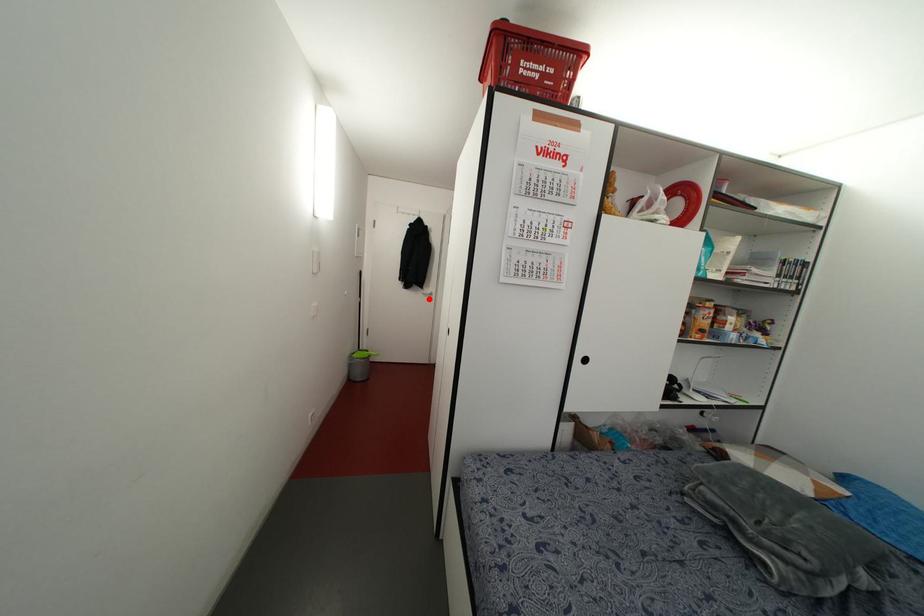
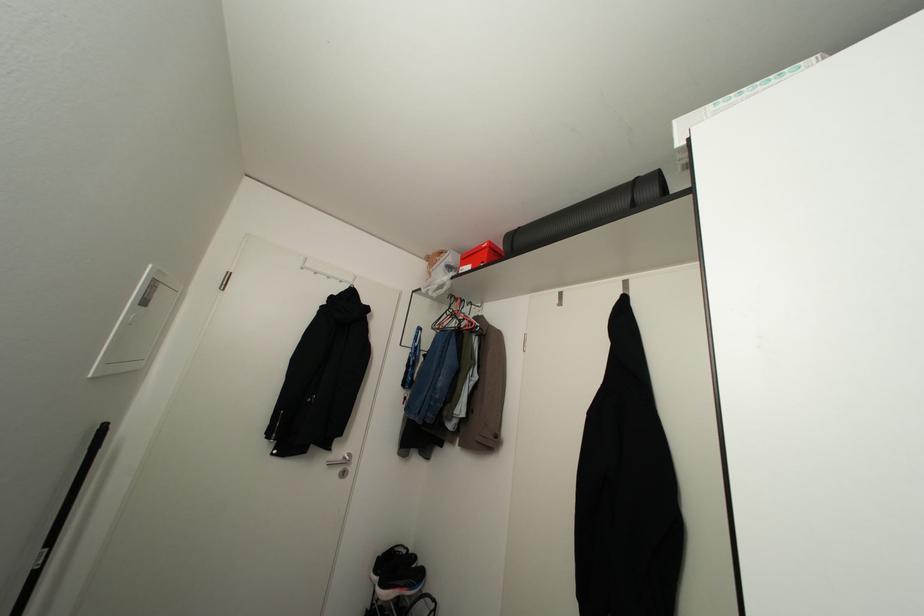
Question: I am providing you with two images of the same scene from different viewpoints. In image1, a red point is highlighted. Considering the same 3D point in image2, which of the following is correct?

Choices:
 (A) It is closer
 (B) It is farther

Answer: (B)